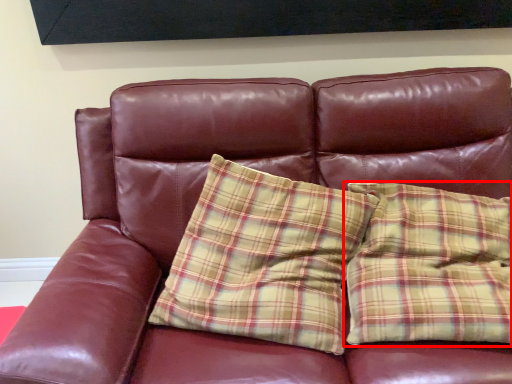
Question: From the image's perspective, where is pillow (annotated by the red box) located in relation to pillow in the image?

Choices:
 (A) below
 (B) above

Answer: (B)